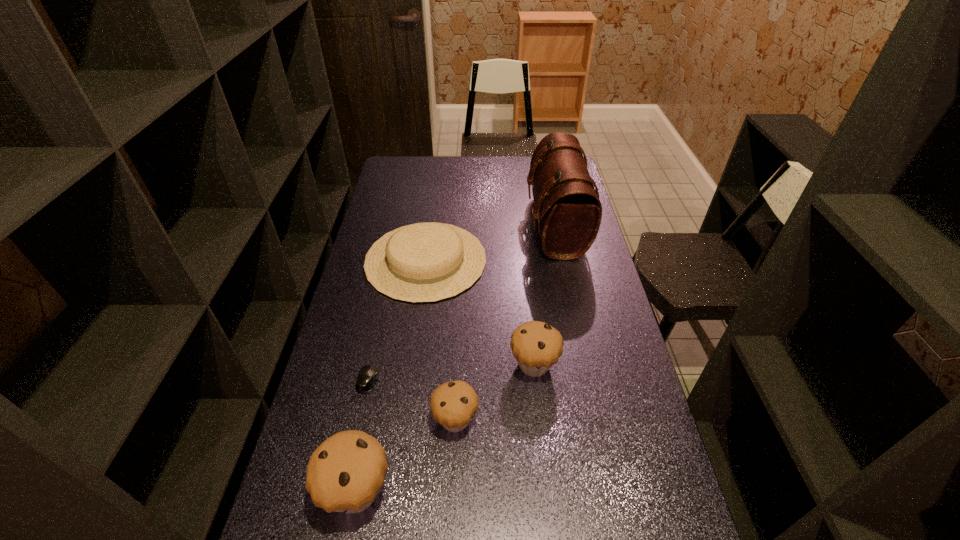
Find the location of `mouse positioned at the left edge`. mouse positioned at the left edge is located at coordinates (368, 375).

Identify the location of object that is positioned at the right edge. This screenshot has height=540, width=960. (567, 206).

I want to click on object at the near left corner, so pos(345,473).

In the image, there is a desktop. At what (x,y) coordinates should I click in order to perform the action: click on vacant space at the near edge. Please return your answer as a coordinate pair (x, y). Looking at the image, I should click on (409, 521).

The image size is (960, 540). Find the location of `free space at the left edge of the desktop`. free space at the left edge of the desktop is located at coordinates (349, 295).

Find the location of `vacant space at the right edge of the desktop`. vacant space at the right edge of the desktop is located at coordinates (596, 258).

Identify the location of empty space that is in between the nearest object and the satchel. This screenshot has width=960, height=540. (456, 358).

Locate an element on the screen. The width and height of the screenshot is (960, 540). vacant space that is in between the tallest object and the farthest muffin is located at coordinates (544, 295).

Find the location of a particular element. The image size is (960, 540). free point between the sunhat and the satchel is located at coordinates (491, 243).

You are a GUI agent. You are given a task and a screenshot of the screen. Output one action in this format:
    pyautogui.click(x=<x>, y=<y>)
    Task: Click on the free space that is in between the second farthest muffin and the shortest object
    The image size is (960, 540).
    Given the screenshot: What is the action you would take?
    pyautogui.click(x=412, y=400)